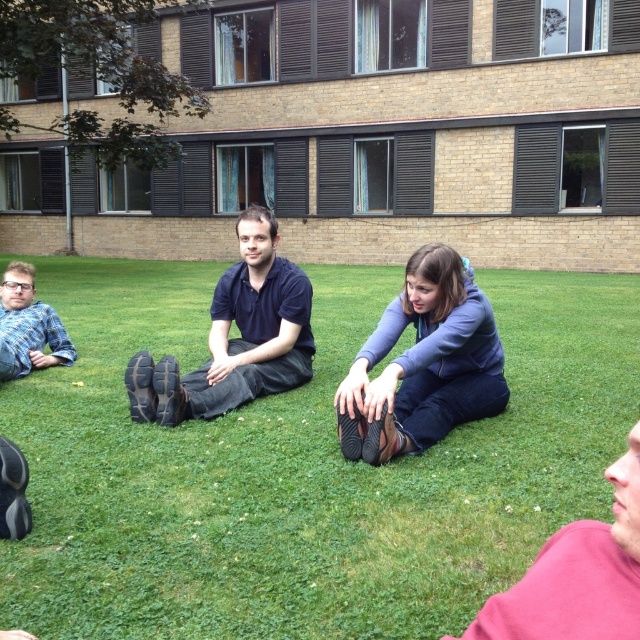
What are the coordinates of `green grass at center` in the screenshot? It's located at (300, 467).

Find the location of a particular element. This screenshot has width=640, height=640. green grass at center is located at coordinates (300, 467).

Looking at this image, who is positioned more to the left, blue denim jeans at center or pink fabric shirt at lower right?

pink fabric shirt at lower right is more to the left.

Is blue denim jeans at center below pink fabric shirt at lower right?

No, blue denim jeans at center is not below pink fabric shirt at lower right.

Locate an element on the screen. blue denim jeans at center is located at coordinates (422, 364).

Does green grass at center appear over dark blue cotton shirt at center?

Yes, green grass at center is above dark blue cotton shirt at center.

Which is behind, point (593, 404) or point (177, 374)?

The point (593, 404) is more distant.

Which is in front, point (77, 344) or point (253, 268)?

Point (253, 268) is in front.

Locate an element on the screen. This screenshot has height=640, width=640. green grass at center is located at coordinates (300, 467).